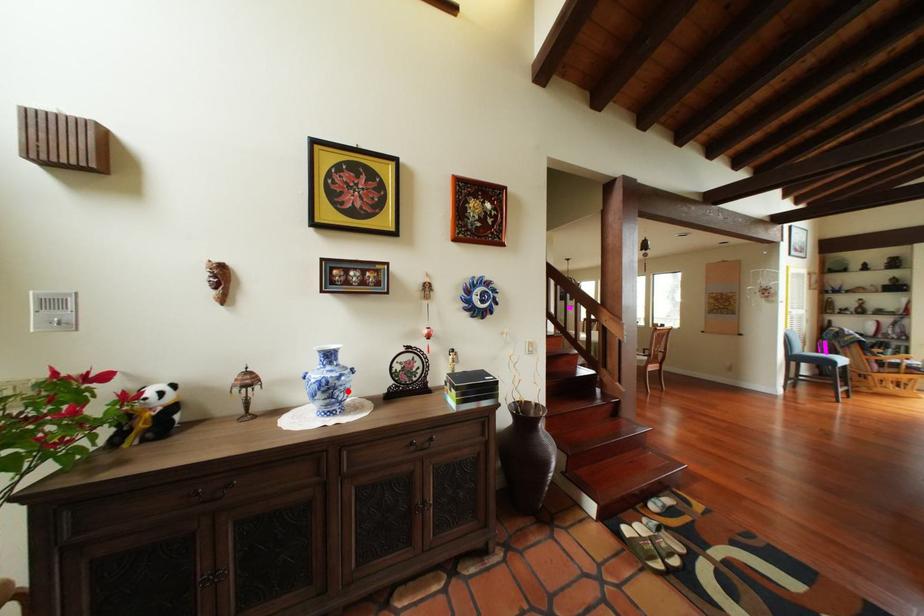
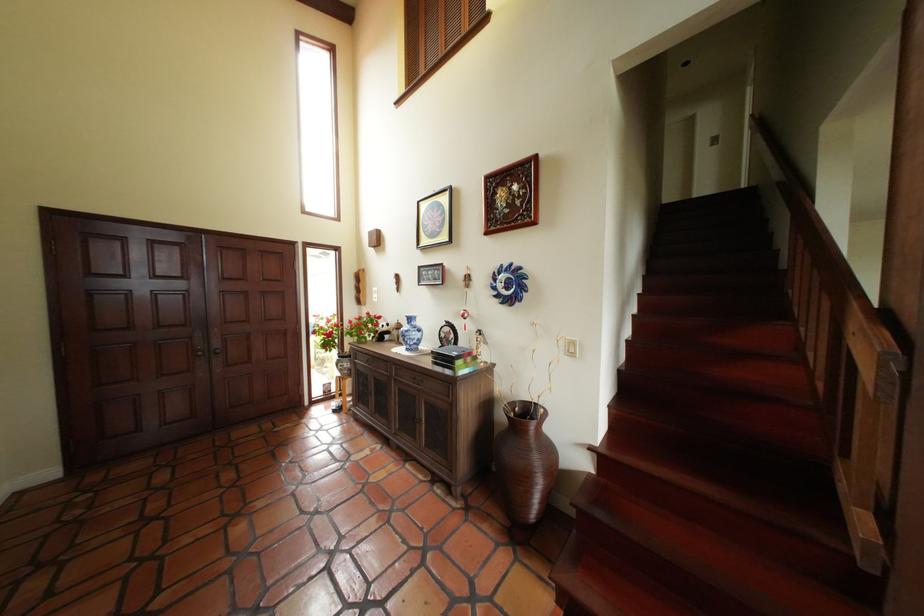
The point at the highlighted location is marked in the first image. Where is the corresponding point in the second image?

(418, 338)